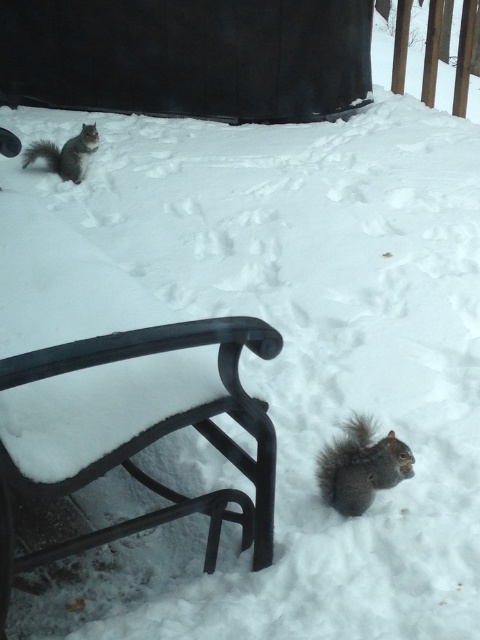
You are standing in a snowy park and see the black metal bench at lower left and the gray furry squirrel at lower right. Which object is located to the left of the other?

The black metal bench at lower left is positioned on the left side of gray furry squirrel at lower right, so the bench is to the left of the squirrel.

Based on the photo, based on the coordinates provided in the image, where is the gray furry squirrel at lower right located?

The gray furry squirrel at lower right is located at the 2D coordinates point (x=360, y=467).

You are a photographer trying to capture both the gray furry squirrel at lower right and the gray furry squirrel at upper left in a single frame. Which squirrel will appear smaller in the photo?

The gray furry squirrel at lower right will appear smaller in the photo because it occupies less space than the gray furry squirrel at upper left.